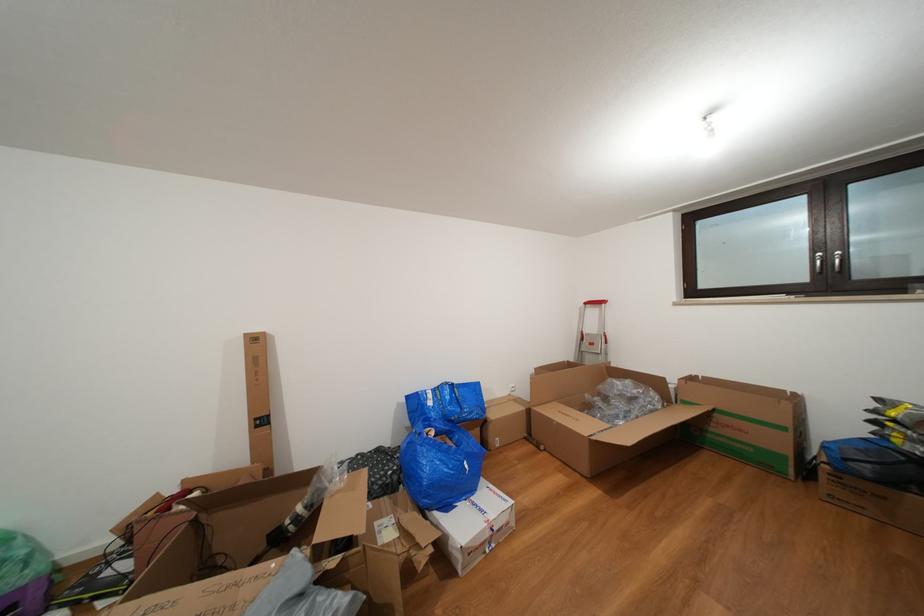
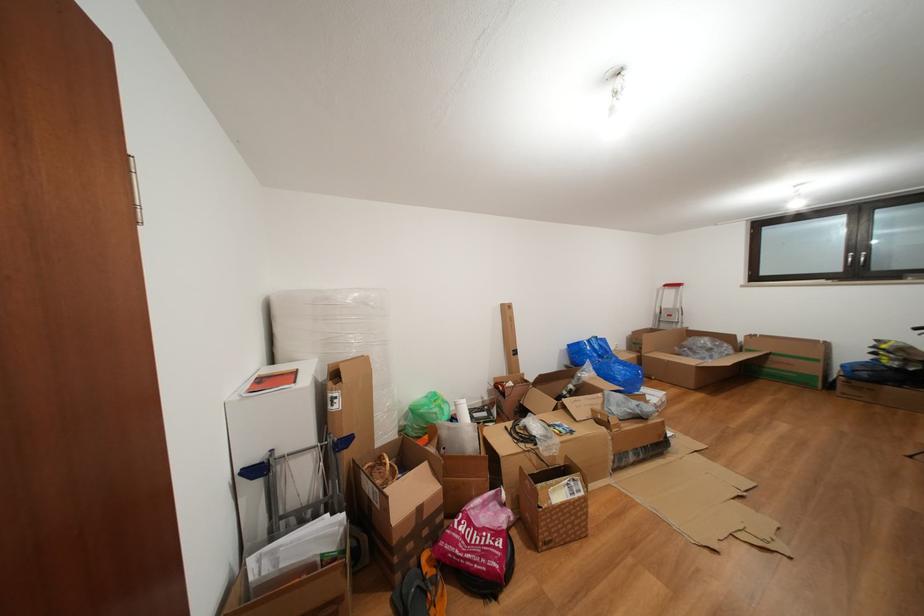
The point at (791, 434) is marked in the first image. Where is the corresponding point in the second image?

(824, 366)